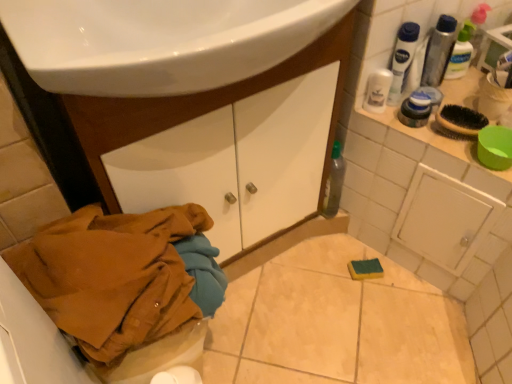
Identify the location of vacant space to the right of white plastic mouthwash at upper right, marked as the first mouthwash in a left-to-right arrangement. (454, 118).